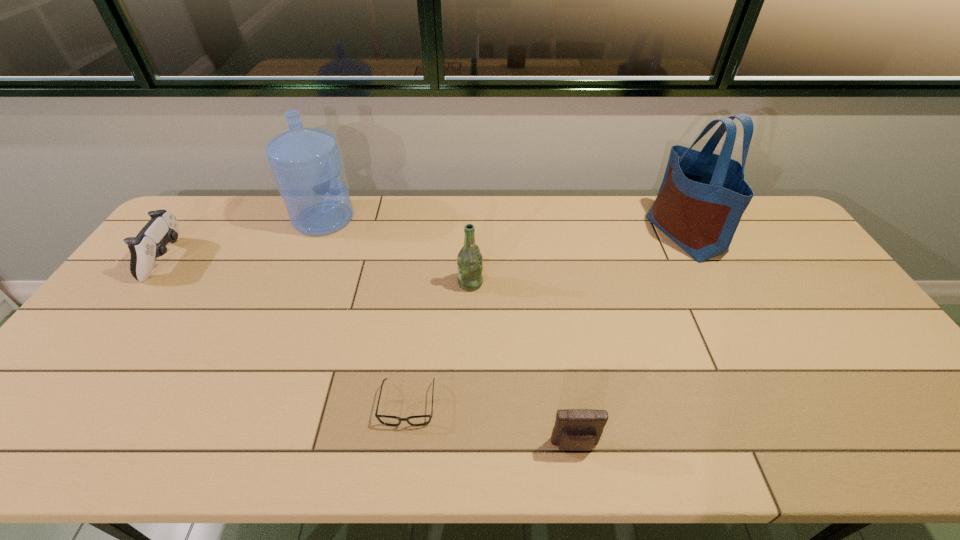
This screenshot has width=960, height=540. In order to click on the rightmost object in this screenshot , I will do pos(701,200).

This screenshot has height=540, width=960. Identify the location of water jug. (306, 162).

Locate an element on the screen. The image size is (960, 540). the fourth shortest object is located at coordinates (469, 260).

Locate an element on the screen. Image resolution: width=960 pixels, height=540 pixels. beer bottle is located at coordinates (469, 260).

Identify the location of control. This screenshot has width=960, height=540. (150, 243).

You are a GUI agent. You are given a task and a screenshot of the screen. Output one action in this format:
    pyautogui.click(x=<x>, y=<y>)
    Task: Click on the nearest object
    The width and height of the screenshot is (960, 540).
    Given the screenshot: What is the action you would take?
    pyautogui.click(x=575, y=429)

Locate an element on the screen. pouch is located at coordinates (575, 429).

The height and width of the screenshot is (540, 960). Find the location of `spectacles`. spectacles is located at coordinates (420, 420).

Where is `the fifth farthest object`? the fifth farthest object is located at coordinates (420, 420).

You are a GUI agent. You are given a task and a screenshot of the screen. Output one action in this format:
    pyautogui.click(x=<x>, y=<y>)
    Task: Click on the vacant position located 0.110m on the left of the rightmost object
    The height and width of the screenshot is (540, 960).
    Given the screenshot: What is the action you would take?
    pyautogui.click(x=619, y=234)